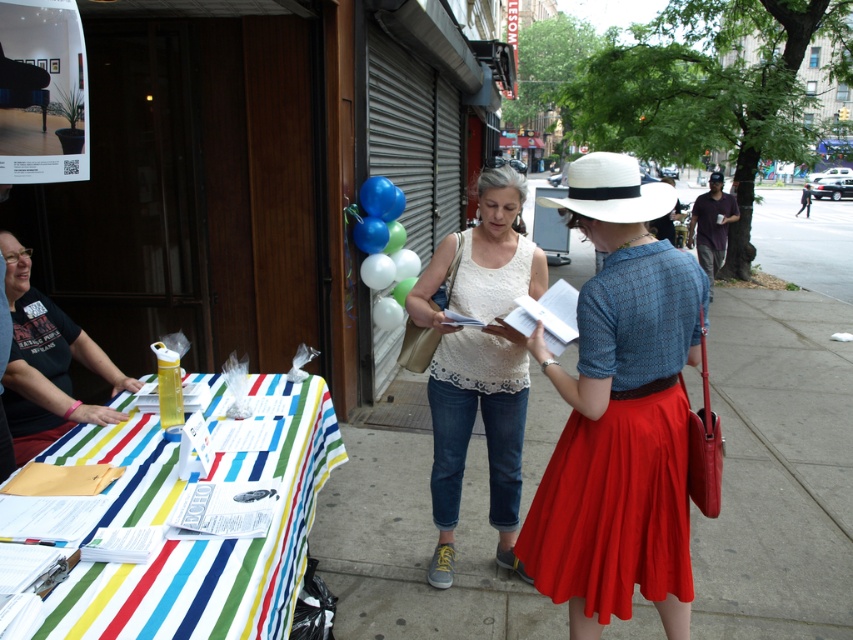
You are a passerby who wants to know which clothing item is smaller between the matte blue blouse at center and the white lace tank top at center. Can you determine which one is smaller?

The matte blue blouse at center is smaller than the white lace tank top at center.

Where is the matte blue blouse at center located in the image?

The matte blue blouse at center is located at point (619, 413).

You are standing in the middle of the sidewalk and want to approach the white lace dress at center. Is the dress closer to you or further away compared to the smooth concrete sidewalk at center?

The smooth concrete sidewalk at center is further to the viewer than the white lace dress at center, so the dress is closer to you than the sidewalk.